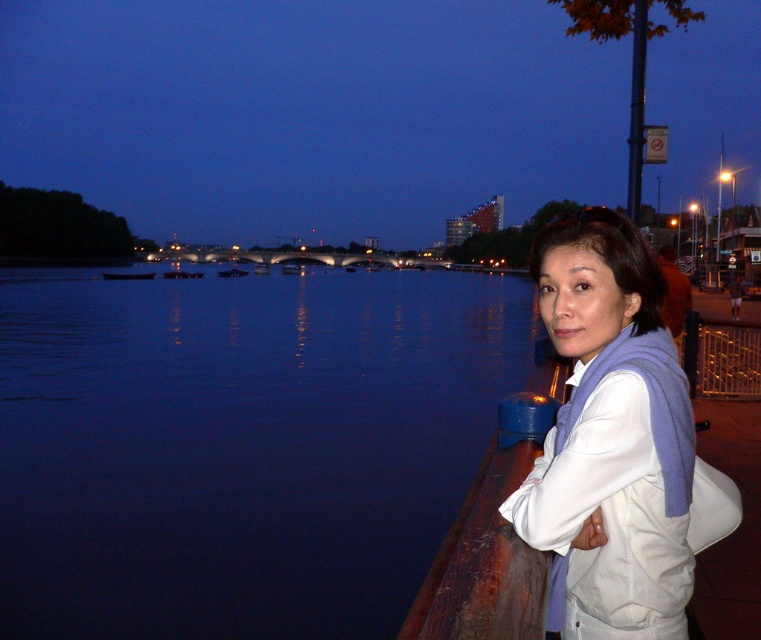
Question: Among these points, which one is nearest to the camera?

Choices:
 (A) (131, 275)
 (B) (177, 275)

Answer: (A)

Question: Which object appears closest to the camera in this image?

Choices:
 (A) white matte scarf at right
 (B) metallic silver boat at center
 (C) dark blue wooden boat at center
 (D) dark blue fabric boat at center

Answer: (A)

Question: Where is dark blue wooden boat at center located in relation to metallic silver boat at center in the image?

Choices:
 (A) left
 (B) right

Answer: (A)

Question: Does dark blue wooden boat at center appear on the right side of dark blue fabric boat at center?

Choices:
 (A) no
 (B) yes

Answer: (A)

Question: Does white matte scarf at right appear on the left side of dark blue fabric boat at center?

Choices:
 (A) no
 (B) yes

Answer: (A)

Question: Which object is positioned farthest from the dark blue fabric boat at center?

Choices:
 (A) white matte scarf at right
 (B) dark blue wooden boat at center

Answer: (A)